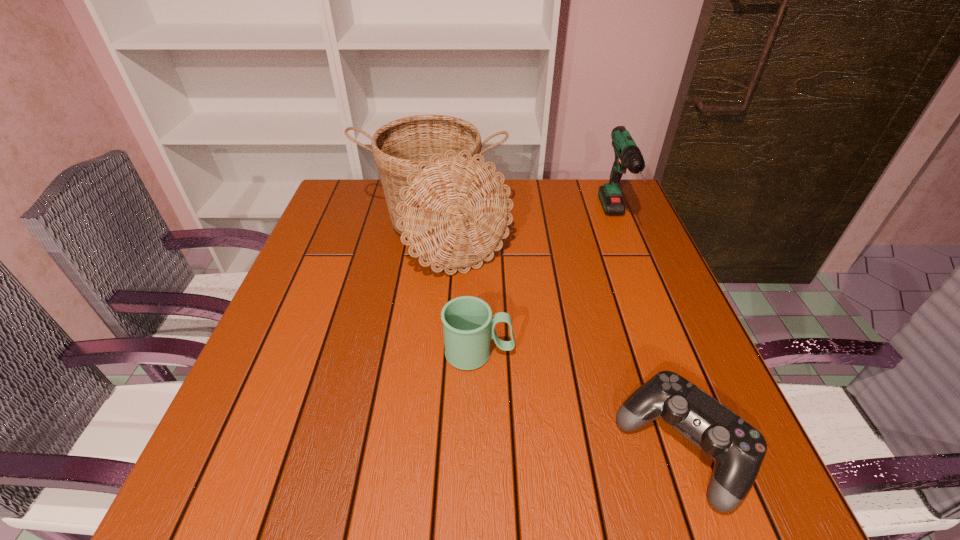
The image size is (960, 540). In order to click on vacant space that satisfies the following two spatial constraints: 1. on the side of the second nearest object with the handle; 2. on the back side of the shortest object in this screenshot , I will do `click(479, 448)`.